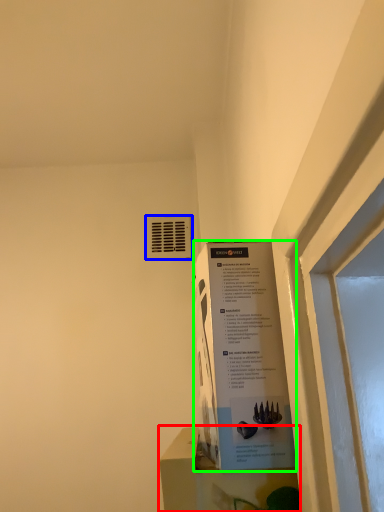
Question: Which is nearer to the window sill (highlighted by a red box)? air conditioning (highlighted by a blue box) or poster (highlighted by a green box).

Choices:
 (A) air conditioning
 (B) poster

Answer: (B)